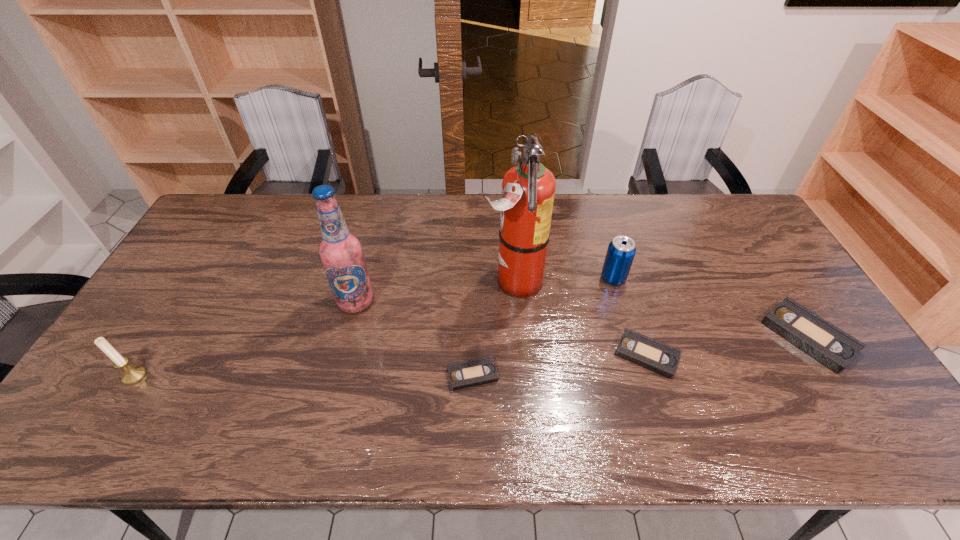
What are the coordinates of `free space between the tallest object and the sixth tallest object` in the screenshot? It's located at (580, 318).

Find the location of `vacant area that lies between the sixth tallest object and the sixth object from right to left`. vacant area that lies between the sixth tallest object and the sixth object from right to left is located at coordinates (501, 328).

The width and height of the screenshot is (960, 540). I want to click on free spot between the alcohol and the rightmost object, so click(x=583, y=319).

Find the location of a particular element. This screenshot has width=960, height=540. vacant space that's between the candle holder and the sixth object from right to left is located at coordinates (245, 339).

Where is `empty space that is in between the shortest videotape and the fire extinguisher`? Image resolution: width=960 pixels, height=540 pixels. empty space that is in between the shortest videotape and the fire extinguisher is located at coordinates (492, 328).

Where is `free space that is in between the second shortest object and the pop soda`? This screenshot has width=960, height=540. free space that is in between the second shortest object and the pop soda is located at coordinates (630, 316).

The image size is (960, 540). In order to click on vacant area between the fire extinguisher and the second videotape from left to right in this screenshot , I will do `click(580, 318)`.

Locate an element on the screen. The height and width of the screenshot is (540, 960). object that stands as the fourth closest to the shortest videotape is located at coordinates pos(621,251).

Identify which object is the second closest to the pop soda. Please provide its 2D coordinates. Your answer should be formatted as a tuple, i.e. [(x, y)], where the tuple contains the x and y coordinates of a point satisfying the conditions above.

[(528, 188)]

Find the location of `videotape that is the third closest to the candle holder`. videotape that is the third closest to the candle holder is located at coordinates (828, 344).